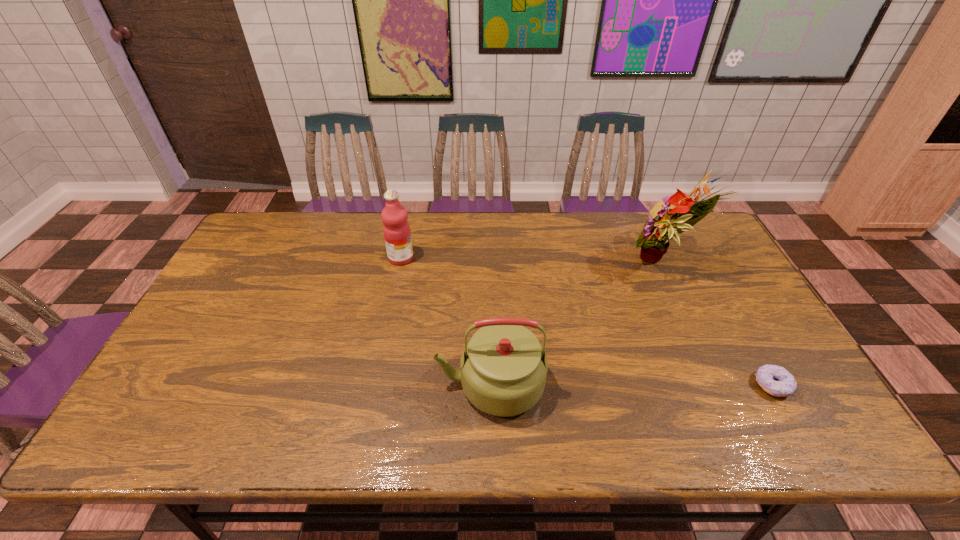
The width and height of the screenshot is (960, 540). What are the coordinates of `free space that satisfies the following two spatial constraints: 1. on the label of the leftmost object; 2. on the right side of the doughnut` in the screenshot? It's located at (375, 385).

Find the location of a particular element. This screenshot has width=960, height=540. free spot that satisfies the following two spatial constraints: 1. on the label of the leftmost object; 2. on the right side of the doughnut is located at coordinates (375, 385).

The width and height of the screenshot is (960, 540). I want to click on vacant point that satisfies the following two spatial constraints: 1. on the front-facing side of the tallest object; 2. on the left side of the doughnut, so click(719, 385).